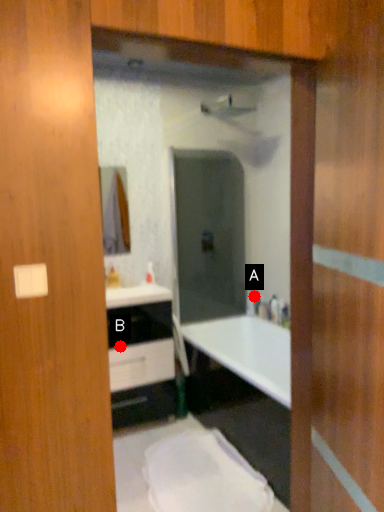
Question: Two points are circled on the image, labeled by A and B beside each circle. Which point appears closest to the camera in this image?

Choices:
 (A) A is closer
 (B) B is closer

Answer: (B)